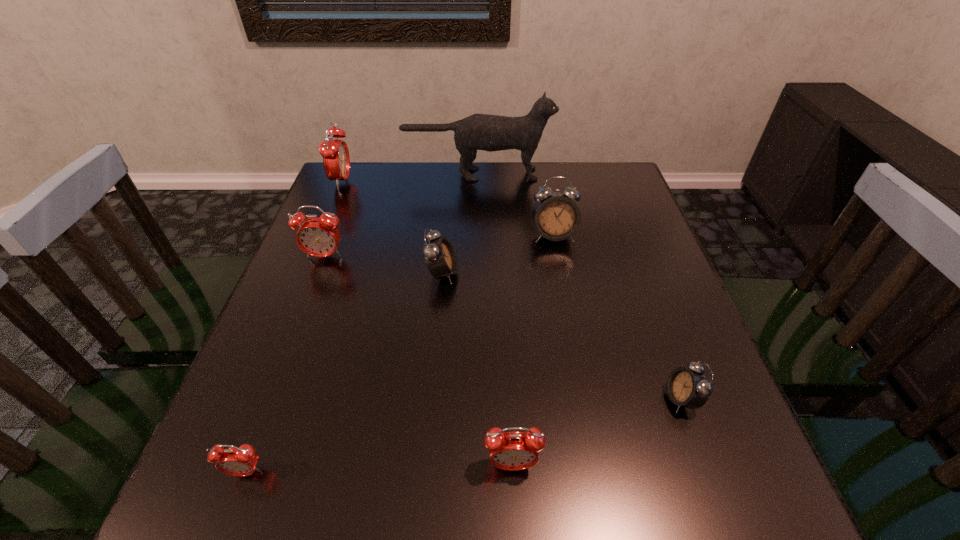
In order to click on the tallest object in this screenshot , I will do `click(486, 132)`.

Where is `cat`? cat is located at coordinates (486, 132).

The width and height of the screenshot is (960, 540). Identify the location of the farthest red alarm clock. (335, 153).

The image size is (960, 540). Identify the location of the farthest alarm clock. (335, 153).

Identify the location of the second white alarm clock from left to right. The width and height of the screenshot is (960, 540). (556, 216).

The width and height of the screenshot is (960, 540). I want to click on the sixth alarm clock from left to right, so click(556, 216).

This screenshot has width=960, height=540. In order to click on the third smallest red alarm clock in this screenshot , I will do `click(317, 236)`.

You are a GUI agent. You are given a task and a screenshot of the screen. Output one action in this format:
    pyautogui.click(x=<x>, y=<y>)
    Task: Click on the fourth alarm clock from left to right
    The width and height of the screenshot is (960, 540).
    Given the screenshot: What is the action you would take?
    pyautogui.click(x=440, y=258)

Identify the location of the leftmost white alarm clock. [440, 258].

Find the location of `the third biggest red alarm clock`. the third biggest red alarm clock is located at coordinates (513, 450).